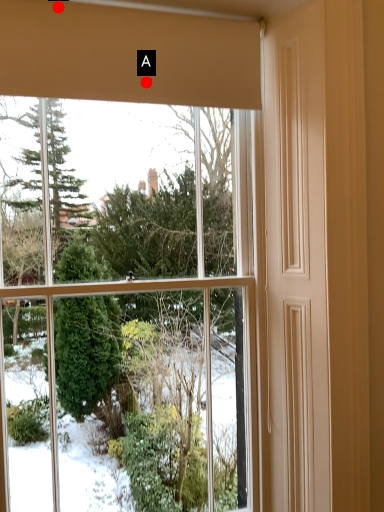
Question: Two points are circled on the image, labeled by A and B beside each circle. Which point is closer to the camera taking this photo?

Choices:
 (A) A is closer
 (B) B is closer

Answer: (B)